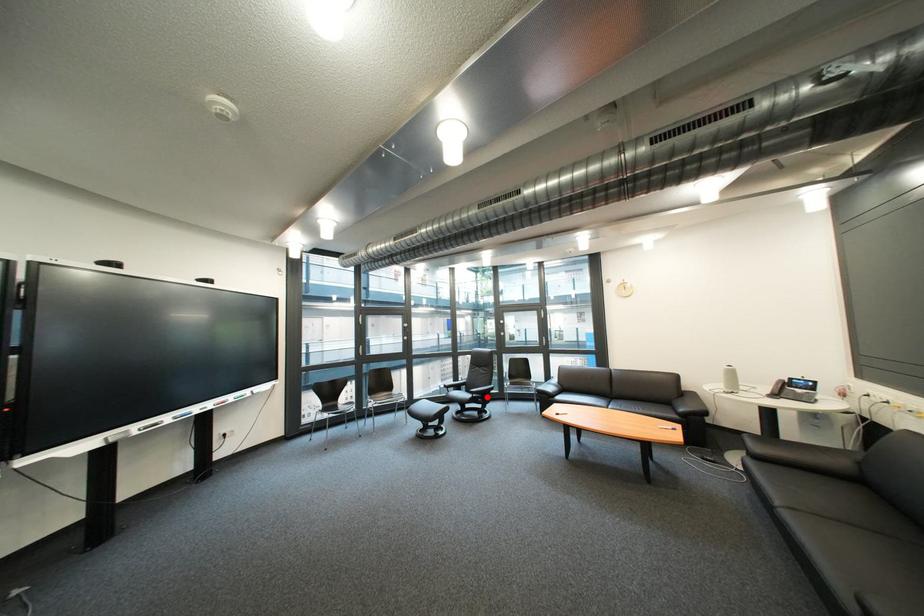
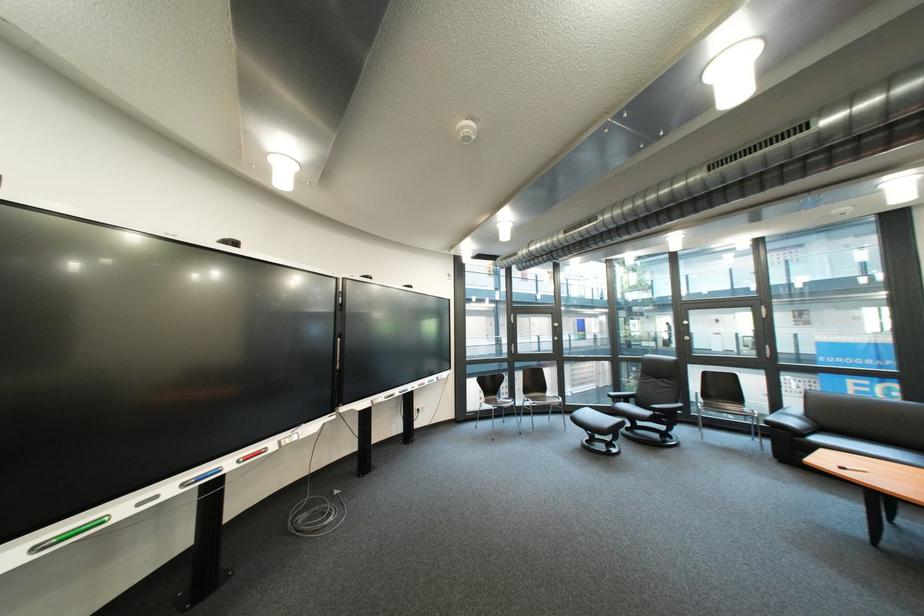
Question: I am providing you with two images of the same scene from different viewpoints. Given a red point in image1, look at the same physical point in image2. Is it:

Choices:
 (A) Closer to the viewpoint
 (B) Farther from the viewpoint

Answer: (A)